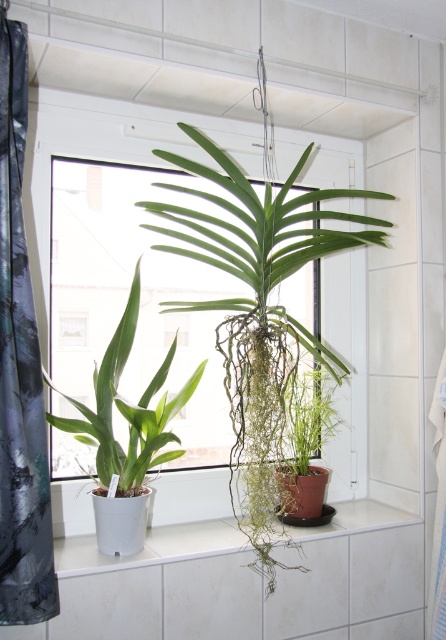
You are trying to place a new potted plant on the white ceramic window sill at center. The new plant is as wide as the green glossy leafy plant at center. Will it fit on the window sill?

The green glossy leafy plant at center has a lesser width compared to the white ceramic window sill at center. Since the new plant is as wide as the existing one, it should fit on the window sill as the sill is wider than the plant.